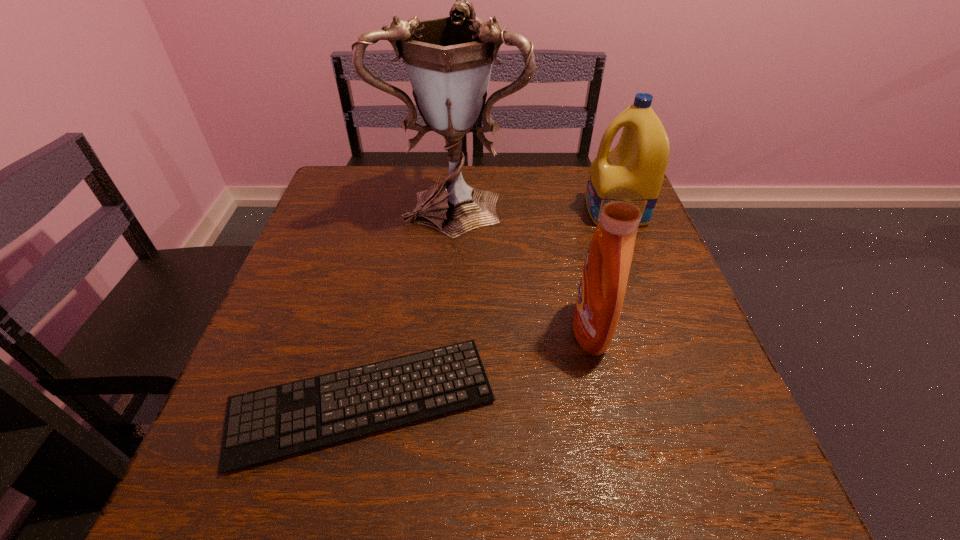
Find the location of a particular element. Image resolution: width=960 pixels, height=540 pixels. free space that is in between the computer keyboard and the trophy cup is located at coordinates (409, 301).

Locate an element on the screen. free spot between the tallest object and the nearer detergent is located at coordinates (522, 266).

Identify which object is the third nearest to the shortest object. Please provide its 2D coordinates. Your answer should be formatted as a tuple, i.e. [(x, y)], where the tuple contains the x and y coordinates of a point satisfying the conditions above.

[(639, 161)]

The width and height of the screenshot is (960, 540). Identify the location of object that is the closest one to the shortest object. pyautogui.click(x=604, y=278).

You are a GUI agent. You are given a task and a screenshot of the screen. Output one action in this format:
    pyautogui.click(x=<x>, y=<y>)
    Task: Click on the vacant space that satisfies the following two spatial constraints: 1. on the back side of the trophy cup; 2. on the right side of the computer keyboard
    
    Given the screenshot: What is the action you would take?
    pyautogui.click(x=405, y=201)